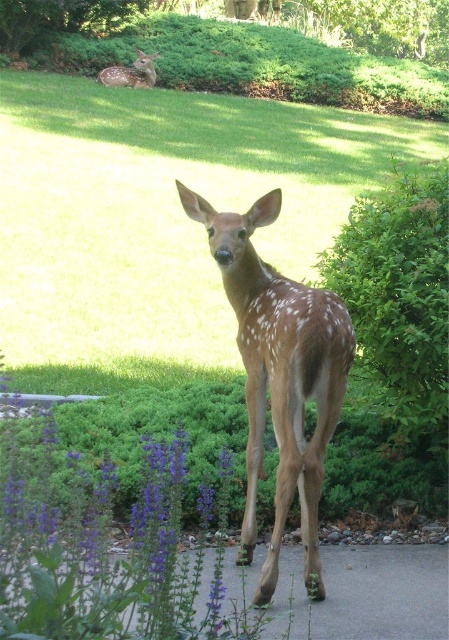
Question: Can you confirm if gray asphalt pavement at lower center is wider than spotted fur deer at upper left?

Choices:
 (A) no
 (B) yes

Answer: (A)

Question: Does brown speckled fur at center appear on the right side of gray asphalt pavement at lower center?

Choices:
 (A) yes
 (B) no

Answer: (B)

Question: Does brown speckled fur at center have a smaller size compared to spotted fur deer at upper left?

Choices:
 (A) yes
 (B) no

Answer: (B)

Question: Which of the following is the farthest from the observer?

Choices:
 (A) click(194, 218)
 (B) click(404, 564)

Answer: (B)

Question: Among these points, which one is farthest from the camera?

Choices:
 (A) (249, 586)
 (B) (136, 74)

Answer: (B)

Question: Based on their relative distances, which object is farther from the spotted fur deer at upper left?

Choices:
 (A) brown speckled fur at center
 (B) gray asphalt pavement at lower center

Answer: (B)